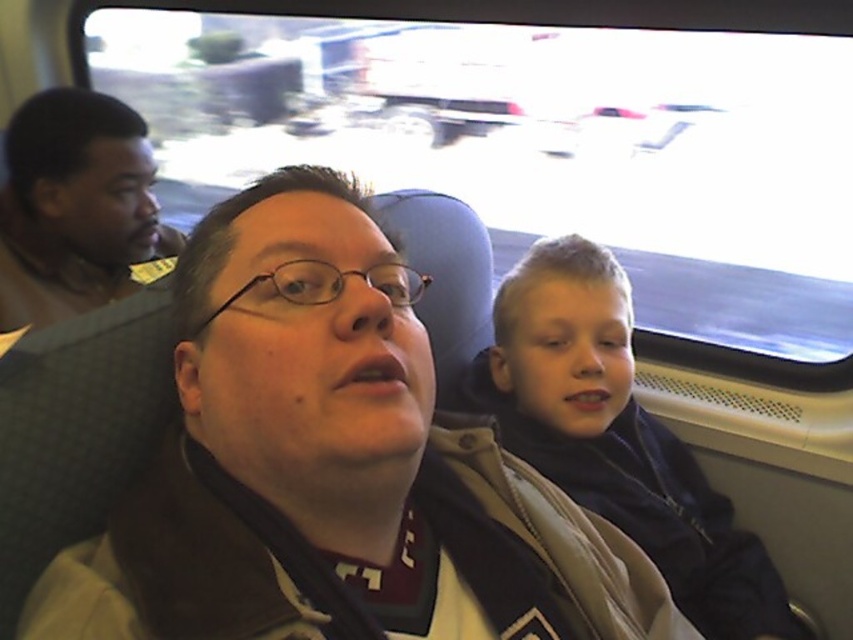
Which is more to the right, matte brown jacket at center or brown leather jacket at left?

Positioned to the right is matte brown jacket at center.

Which is above, matte brown jacket at center or brown leather jacket at left?

brown leather jacket at left is higher up.

The height and width of the screenshot is (640, 853). I want to click on matte brown jacket at center, so click(x=332, y=467).

This screenshot has height=640, width=853. I want to click on matte brown jacket at center, so click(332, 467).

Describe the element at coordinates (332, 467) in the screenshot. Image resolution: width=853 pixels, height=640 pixels. I see `matte brown jacket at center` at that location.

At what (x,y) coordinates should I click in order to perform the action: click on matte brown jacket at center. Please return your answer as a coordinate pair (x, y). This screenshot has width=853, height=640. Looking at the image, I should click on (332, 467).

Is point (490, 384) positioned behind point (142, 134)?

No, it is not.

Is point (498, 349) behind point (151, 253)?

No, it is in front of (151, 253).

At what (x,y) coordinates should I click in order to perform the action: click on dark blue jacket at center. Please return your answer as a coordinate pair (x, y). The image size is (853, 640). Looking at the image, I should click on (616, 436).